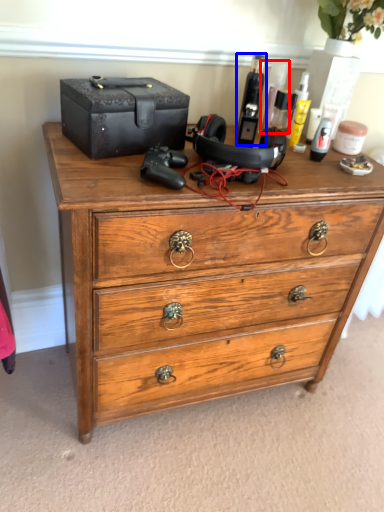
Question: Which object is further to the camera taking this photo, toiletry (highlighted by a red box) or toiletry (highlighted by a blue box)?

Choices:
 (A) toiletry
 (B) toiletry

Answer: (A)